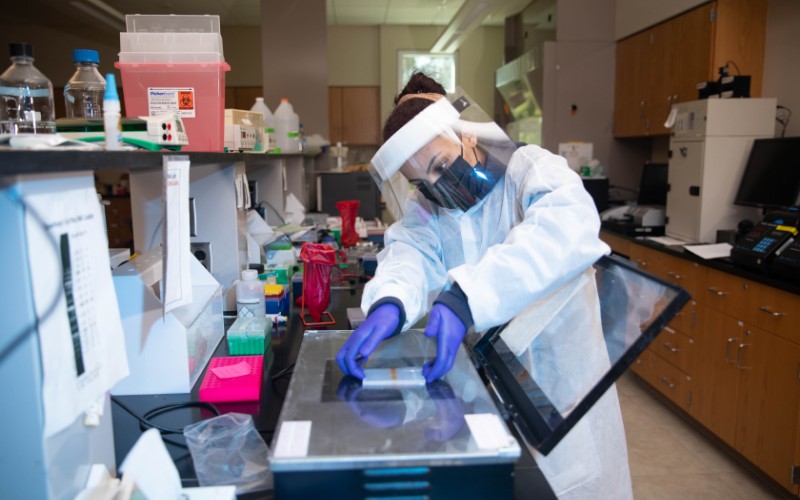
Locate an element on the screen. The width and height of the screenshot is (800, 500). cords is located at coordinates (126, 412), (170, 433), (786, 115), (740, 66), (269, 207), (24, 208).